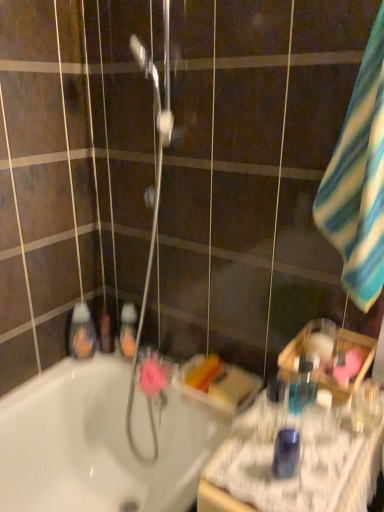
Identify the location of free space above translucent plastic basket at right (from a real-world perspective). (308, 430).